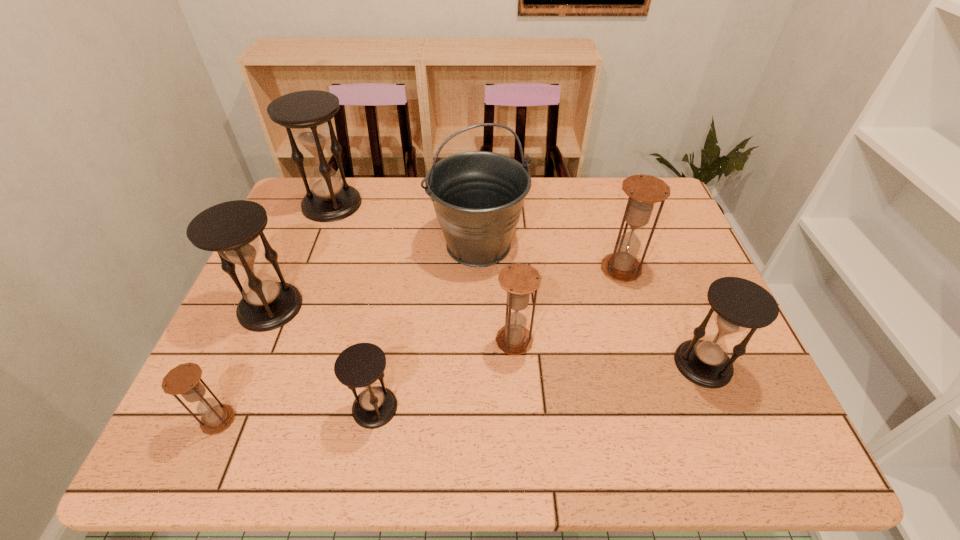
Identify the location of vacant space located 0.080m on the left of the smallest black hourglass. The width and height of the screenshot is (960, 540). (314, 408).

Identify the location of free space located 0.260m on the back of the nearest brown hourglass. This screenshot has height=540, width=960. (267, 309).

Find the location of a particular element. The height and width of the screenshot is (540, 960). bucket located in the far edge section of the desktop is located at coordinates (478, 196).

In order to click on hourglass that is at the far edge in this screenshot , I will do (x=329, y=198).

The height and width of the screenshot is (540, 960). What are the coordinates of `object at the far left corner` in the screenshot? It's located at (329, 198).

Find the location of a particular element. object that is at the near left corner is located at coordinates (184, 379).

In the image, there is a desktop. What are the coordinates of `free region at the far edge` in the screenshot? It's located at coord(543,186).

You are a GUI agent. You are given a task and a screenshot of the screen. Output one action in this format:
    pyautogui.click(x=<x>, y=<y>)
    Task: Click on the free point at the near edge
    
    Given the screenshot: What is the action you would take?
    pyautogui.click(x=420, y=422)

In the image, there is a desktop. At what (x,y) coordinates should I click in order to perform the action: click on vacant area at the left edge. Please return your answer as a coordinate pair (x, y). This screenshot has width=960, height=540. Looking at the image, I should click on (328, 242).

Locate an element on the screen. This screenshot has width=960, height=540. free spot between the bucket and the second farthest black hourglass is located at coordinates (374, 276).